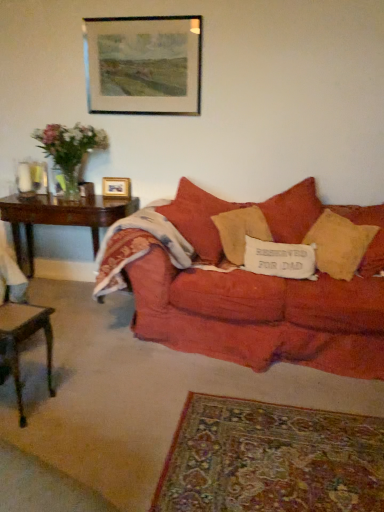
Identify the location of translucent glass vase at left. This screenshot has height=512, width=384. (70, 148).

Measure the distance between textured beige pillow at center, placed as the 2th pillow when sorted from right to left, and camera.

textured beige pillow at center, placed as the 2th pillow when sorted from right to left, and camera are 8.84 feet apart.

What do you see at coordinates (116, 188) in the screenshot? I see `wooden picture frame at upper center, positioned as the second picture frame in top-to-bottom order` at bounding box center [116, 188].

Where is `wooden picture frame at upper center, the 2th picture frame when ordered from bottom to top`? The width and height of the screenshot is (384, 512). wooden picture frame at upper center, the 2th picture frame when ordered from bottom to top is located at coordinates (143, 65).

Locate an element on the screen. Image resolution: width=384 pixels, height=512 pixels. translucent glass vase at left is located at coordinates (70, 148).

Which point is more forward, (279, 247) or (195, 321)?

The point (195, 321) is in front.

From a real-world perspective, is white fabric pillow at center, the first pillow from the left, below matte red couch at center?

No, from a real-world perspective, white fabric pillow at center, the first pillow from the left, is not under matte red couch at center.

I want to click on studio couch below the white fabric pillow at center, the 3th pillow positioned from the right (from the image's perspective), so click(260, 308).

Between textured beige pillow at center, which appears as the second pillow when viewed from the left, and translucent glass vase at left, which one is positioned in front?

textured beige pillow at center, which appears as the second pillow when viewed from the left, is in front.

Is textured beige pillow at center, placed as the 2th pillow when sorted from right to left, situated inside translucent glass vase at left or outside?

textured beige pillow at center, placed as the 2th pillow when sorted from right to left, exists outside the volume of translucent glass vase at left.

Which is more to the left, textured beige pillow at center, which appears as the second pillow when viewed from the left, or translucent glass vase at left?

From the viewer's perspective, translucent glass vase at left appears more on the left side.

At what (x,y) coordinates should I click in order to perform the action: click on flower above the textured beige pillow at center, placed as the 2th pillow when sorted from right to left (from a real-world perspective). Please return your answer as a coordinate pair (x, y). The height and width of the screenshot is (512, 384). Looking at the image, I should click on (70, 148).

From their relative heights in the image, would you say matte red couch at center is taller or shorter than white fabric pillow at center, the first pillow from the left?

In the image, matte red couch at center appears to be taller than white fabric pillow at center, the first pillow from the left.

Can you tell me how much matte red couch at center and white fabric pillow at center, the first pillow from the left, differ in facing direction?

The facing directions of matte red couch at center and white fabric pillow at center, the first pillow from the left, are 8.41 degrees apart.

From the picture: Between matte red couch at center and white fabric pillow at center, the 3th pillow positioned from the right, which one has smaller size?

white fabric pillow at center, the 3th pillow positioned from the right, is smaller.

Between matte red couch at center and white fabric pillow at center, the 3th pillow positioned from the right, which one appears on the left side from the viewer's perspective?

Positioned to the left is matte red couch at center.

Which is behind, point (275, 223) or point (273, 263)?

The point (275, 223) is behind.

Is textured beige pillow at center, which appears as the second pillow when viewed from the left, touching white fabric pillow at center, the 3th pillow positioned from the right?

No, textured beige pillow at center, which appears as the second pillow when viewed from the left, is not beside white fabric pillow at center, the 3th pillow positioned from the right.

Which object is positioned more to the left, textured beige pillow at center, placed as the 2th pillow when sorted from right to left, or white fabric pillow at center, the 3th pillow positioned from the right?

Positioned to the left is white fabric pillow at center, the 3th pillow positioned from the right.

Can you confirm if dark wood table at left, the second table positioned from the front, is shorter than white fabric pillow at center, the 3th pillow positioned from the right?

In fact, dark wood table at left, the second table positioned from the front, may be taller than white fabric pillow at center, the 3th pillow positioned from the right.

Which point is more forward, (133, 210) or (266, 260)?

The point (266, 260) is more forward.

Is dark wood table at left, marked as the 1th table in a top-to-bottom arrangement, aimed at white fabric pillow at center, the first pillow from the left?

No, dark wood table at left, marked as the 1th table in a top-to-bottom arrangement, is not aimed at white fabric pillow at center, the first pillow from the left.

Is soft yellow pillow at right, which is the third pillow in left-to-right order, outside of wooden picture frame at upper center, the 1th picture frame viewed from the back?

Indeed, soft yellow pillow at right, which is the third pillow in left-to-right order, is completely outside wooden picture frame at upper center, the 1th picture frame viewed from the back.

From the image's perspective, does soft yellow pillow at right, which is the third pillow in left-to-right order, appear higher than wooden picture frame at upper center, positioned as the second picture frame in top-to-bottom order?

Actually, soft yellow pillow at right, which is the third pillow in left-to-right order, appears below wooden picture frame at upper center, positioned as the second picture frame in top-to-bottom order, in the image.

Is soft yellow pillow at right, which ranks as the first pillow in right-to-left order, in front of or behind wooden picture frame at upper center, positioned as the 2th picture frame in front-to-back order, in the image?

soft yellow pillow at right, which ranks as the first pillow in right-to-left order, is in front of wooden picture frame at upper center, positioned as the 2th picture frame in front-to-back order.

How many degrees apart are the facing directions of matte red couch at center and wooden picture frame at upper center, the 1th picture frame viewed from the back?

The angular difference between matte red couch at center and wooden picture frame at upper center, the 1th picture frame viewed from the back, is 5.63 degrees.

Considering the sizes of matte red couch at center and wooden picture frame at upper center, the first picture frame in the bottom-to-top sequence, in the image, is matte red couch at center bigger or smaller than wooden picture frame at upper center, the first picture frame in the bottom-to-top sequence,?

Considering their sizes, matte red couch at center takes up more space than wooden picture frame at upper center, the first picture frame in the bottom-to-top sequence.

Consider the image. Is matte red couch at center to the left of wooden picture frame at upper center, the first picture frame in the bottom-to-top sequence, from the viewer's perspective?

In fact, matte red couch at center is to the right of wooden picture frame at upper center, the first picture frame in the bottom-to-top sequence.

Is matte red couch at center directly adjacent to wooden picture frame at upper center, the 1th picture frame viewed from the back?

No, matte red couch at center is not beside wooden picture frame at upper center, the 1th picture frame viewed from the back.

Find the location of `studio couch lying in front of the white fabric pillow at center, the 3th pillow positioned from the right`. studio couch lying in front of the white fabric pillow at center, the 3th pillow positioned from the right is located at coordinates (260, 308).

You are a GUI agent. You are given a task and a screenshot of the screen. Output one action in this format:
    pyautogui.click(x=<x>, y=<y>)
    Task: Click on the flower above the textured beige pillow at center, which appears as the second pillow when viewed from the left (from the image's perspective)
    
    Given the screenshot: What is the action you would take?
    pyautogui.click(x=70, y=148)

Which object lies further to the anchor point clear glass vase at left, wooden picture frame at upper center, the first picture frame in the bottom-to-top sequence, or dark wood table at left, the second table positioned from the front?

Based on the image, wooden picture frame at upper center, the first picture frame in the bottom-to-top sequence, appears to be further to clear glass vase at left.

Looking at the image, which one is located closer to textured beige pillow at center, placed as the 2th pillow when sorted from right to left, wooden picture frame at upper center, the first picture frame in the bottom-to-top sequence, or matte red couch at center?

Among the two, matte red couch at center is located nearer to textured beige pillow at center, placed as the 2th pillow when sorted from right to left.

From the image, which object appears to be nearer to wooden side table at lower left, marked as the 1th table in a front-to-back arrangement, matte red couch at center or wooden picture frame at upper center, the 2th picture frame when ordered from bottom to top?

Based on the image, matte red couch at center appears to be nearer to wooden side table at lower left, marked as the 1th table in a front-to-back arrangement.

Based on their spatial positions, is white fabric pillow at center, the first pillow from the left, or wooden picture frame at upper center, the first picture frame in the bottom-to-top sequence, closer to textured beige pillow at center, placed as the 2th pillow when sorted from right to left?

white fabric pillow at center, the first pillow from the left, is positioned closer to the anchor textured beige pillow at center, placed as the 2th pillow when sorted from right to left.

Which object lies further to the anchor point soft yellow pillow at right, which ranks as the first pillow in right-to-left order, dark wood table at left, the 1th table positioned from the back, or wooden side table at lower left, arranged as the second table when viewed from the back?

Among the two, wooden side table at lower left, arranged as the second table when viewed from the back, is located further to soft yellow pillow at right, which ranks as the first pillow in right-to-left order.

Considering their positions, is clear glass vase at left positioned further to textured beige pillow at center, which appears as the second pillow when viewed from the left, than wooden side table at lower left, arranged as the second table when viewed from the back?

wooden side table at lower left, arranged as the second table when viewed from the back, is positioned further to the anchor textured beige pillow at center, which appears as the second pillow when viewed from the left.

Estimate the real-world distances between objects in this image. Which object is further from soft yellow pillow at right, which is the third pillow in left-to-right order, dark wood table at left, the second table positioned from the front, or clear glass vase at left?

The object further to soft yellow pillow at right, which is the third pillow in left-to-right order, is clear glass vase at left.

Estimate the real-world distances between objects in this image. Which object is closer to clear glass vase at left, soft yellow pillow at right, which is the third pillow in left-to-right order, or wooden side table at lower left, arranged as the second table when viewed from the top?

The object closer to clear glass vase at left is wooden side table at lower left, arranged as the second table when viewed from the top.

At what (x,y) coordinates should I click in order to perform the action: click on studio couch between wooden side table at lower left, marked as the 1th table in a front-to-back arrangement, and wooden picture frame at upper center, positioned as the 2th picture frame in front-to-back order, in the front-back direction. Please return your answer as a coordinate pair (x, y). The width and height of the screenshot is (384, 512). Looking at the image, I should click on (260, 308).

The width and height of the screenshot is (384, 512). I want to click on picture frame that lies between wooden picture frame at upper center, the 2th picture frame when ordered from back to front, and white fabric pillow at center, the first pillow from the left, from top to bottom, so click(x=116, y=188).

The width and height of the screenshot is (384, 512). What are the coordinates of `table between wooden picture frame at upper center, the first picture frame when ordered from top to bottom, and white fabric pillow at center, the 3th pillow positioned from the right, in the vertical direction` in the screenshot? It's located at (60, 217).

I want to click on flower between wooden side table at lower left, arranged as the second table when viewed from the top, and wooden picture frame at upper center, positioned as the second picture frame in top-to-bottom order, in the front-back direction, so click(x=70, y=148).